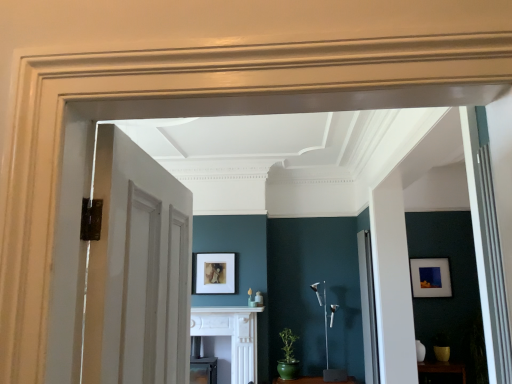
Measure the distance between green matte pot at lower center and camera.

The depth of green matte pot at lower center is 6.25 meters.

In the scene shown: What is the approximate width of white wood door at left, acting as the 2th door starting from the right?

white wood door at left, acting as the 2th door starting from the right, is 8.27 centimeters in width.

Locate an element on the screen. The image size is (512, 384). brown wooden shelf at lower right is located at coordinates (442, 368).

The width and height of the screenshot is (512, 384). I want to click on white marble fireplace at center, so click(x=227, y=309).

Identify the location of matte gold picture frame at center, the 2th picture frame viewed from the right. This screenshot has height=384, width=512. (214, 273).

What is the approximate width of white glossy fireplace at center?

white glossy fireplace at center is 33.21 inches wide.

What do you see at coordinates (368, 308) in the screenshot?
I see `white glossy door at right, which is the 2th door from top to bottom` at bounding box center [368, 308].

This screenshot has width=512, height=384. In order to click on green matte pot at lower center in this screenshot , I will do `click(288, 345)`.

Considering the sizes of objects white glossy door at right, the 2th door in the front-to-back sequence, and white wood door at left, arranged as the second door when viewed from the back, in the image provided, who is bigger, white glossy door at right, the 2th door in the front-to-back sequence, or white wood door at left, arranged as the second door when viewed from the back,?

white glossy door at right, the 2th door in the front-to-back sequence.

Does white glossy door at right, which is counted as the 1th door, starting from the back, touch white wood door at left, the 1th door positioned from the left?

No, white glossy door at right, which is counted as the 1th door, starting from the back, is not making contact with white wood door at left, the 1th door positioned from the left.

Which is correct: white glossy door at right, the 1th door in the right-to-left sequence, is inside white wood door at left, the 1th door positioned from the left, or outside of it?

white glossy door at right, the 1th door in the right-to-left sequence, is outside white wood door at left, the 1th door positioned from the left.

From a real-world perspective, between white glossy door at right, the 1th door in the right-to-left sequence, and white wood door at left, acting as the first door starting from the front, who is vertically lower?

white glossy door at right, the 1th door in the right-to-left sequence, from a real-world perspective.

How different are the orientations of white glossy fireplace at center and white glossy door at right, the 2th door in the front-to-back sequence, in degrees?

The facing directions of white glossy fireplace at center and white glossy door at right, the 2th door in the front-to-back sequence, are 89.6 degrees apart.

Do you think white glossy fireplace at center is within white glossy door at right, which is counted as the 1th door, starting from the back, or outside of it?

The correct answer is: outside.

Is white glossy fireplace at center next to white glossy door at right, which is counted as the 1th door, starting from the back, and touching it?

They are not placed beside each other.

From a real-world perspective, is white glossy fireplace at center over white glossy door at right, which is counted as the 1th door, starting from the back?

Incorrect, from a real-world perspective, white glossy fireplace at center is lower than white glossy door at right, which is counted as the 1th door, starting from the back.

Is green matte pot at lower center facing away from brown wooden shelf at lower right?

No, brown wooden shelf at lower right is not at the back of green matte pot at lower center.

Is green matte pot at lower center outside of brown wooden shelf at lower right?

green matte pot at lower center lies outside brown wooden shelf at lower right's area.

Does green matte pot at lower center come in front of brown wooden shelf at lower right?

No, green matte pot at lower center is further to the viewer.

Based on the photo, from a real-world perspective, is matte gold picture frame at center, which is the second picture frame from back to front, located beneath matte black picture frame at right, acting as the 2th picture frame starting from the front?

No, from a real-world perspective, matte gold picture frame at center, which is the second picture frame from back to front, is not under matte black picture frame at right, acting as the 2th picture frame starting from the front.

In the scene shown: Considering the sizes of objects matte gold picture frame at center, which is the second picture frame from back to front, and matte black picture frame at right, the second picture frame when ordered from left to right, in the image provided, who is shorter, matte gold picture frame at center, which is the second picture frame from back to front, or matte black picture frame at right, the second picture frame when ordered from left to right,?

matte gold picture frame at center, which is the second picture frame from back to front.

Is matte gold picture frame at center, the 2th picture frame viewed from the right, closer to the viewer compared to matte black picture frame at right, the second picture frame when ordered from left to right?

Yes.

Is matte gold picture frame at center, the first picture frame when ordered from front to back, oriented towards matte black picture frame at right, the second picture frame when ordered from left to right?

No, matte gold picture frame at center, the first picture frame when ordered from front to back, is not oriented towards matte black picture frame at right, the second picture frame when ordered from left to right.

Is white wood door at left, positioned as the 1th door in top-to-bottom order, surrounding white marble fireplace at center?

No.

From a real-world perspective, does white wood door at left, positioned as the 1th door in top-to-bottom order, stand above white marble fireplace at center?

Correct, in the physical world, white wood door at left, positioned as the 1th door in top-to-bottom order, is higher than white marble fireplace at center.

Does white wood door at left, the second door positioned from the bottom, appear on the right side of white marble fireplace at center?

Yes, white wood door at left, the second door positioned from the bottom, is to the right of white marble fireplace at center.

In terms of height, does white wood door at left, acting as the first door starting from the front, look taller or shorter compared to white marble fireplace at center?

Considering their sizes, white wood door at left, acting as the first door starting from the front, has more height than white marble fireplace at center.

Is green matte pot at lower center oriented away from white glossy door at right, which is counted as the 1th door, starting from the back?

No, green matte pot at lower center is not facing away from white glossy door at right, which is counted as the 1th door, starting from the back.

Is green matte pot at lower center at the right side of white glossy door at right, the second door viewed from the left?

No.

Between point (233, 345) and point (208, 310), which one is positioned behind?

The point (208, 310) is behind.

From the image's perspective, would you say white glossy fireplace at center is shown under white marble fireplace at center?

Yes, from the image's perspective, white glossy fireplace at center is below white marble fireplace at center.

In the scene shown: From a real-world perspective, is white glossy fireplace at center physically located above or below white marble fireplace at center?

white glossy fireplace at center is situated lower than white marble fireplace at center in the real world.

Does white glossy fireplace at center appear on the left side of white marble fireplace at center?

Yes.

You are a GUI agent. You are given a task and a screenshot of the screen. Output one action in this format:
    pyautogui.click(x=<x>, y=<y>)
    Task: Click on the door in front of the white glossy door at right, which is counted as the 1th door, starting from the bottom
    Image resolution: width=512 pixels, height=384 pixels.
    Given the screenshot: What is the action you would take?
    pyautogui.click(x=137, y=269)

Where is `table to the left of white glossy door at right, which is the 2th door from top to bottom`? The height and width of the screenshot is (384, 512). table to the left of white glossy door at right, which is the 2th door from top to bottom is located at coordinates (232, 336).

From the image, which object appears to be nearer to green matte pot at lower center, white marble fireplace at center or matte gold picture frame at center, the 2th picture frame viewed from the right?

white marble fireplace at center is positioned closer to the anchor green matte pot at lower center.

Estimate the real-world distances between objects in this image. Which object is closer to white glossy fireplace at center, white glossy door at right, which is counted as the 1th door, starting from the back, or matte gold picture frame at center, the 2th picture frame viewed from the right?

Among the two, matte gold picture frame at center, the 2th picture frame viewed from the right, is located nearer to white glossy fireplace at center.

Looking at the image, which one is located closer to matte black picture frame at right, placed as the 1th picture frame when sorted from right to left, white marble fireplace at center or white wood door at left, acting as the 2th door starting from the right?

The object closer to matte black picture frame at right, placed as the 1th picture frame when sorted from right to left, is white marble fireplace at center.

When comparing their distances from white glossy door at right, the 1th door in the right-to-left sequence, does white wood door at left, the second door positioned from the bottom, or matte black picture frame at right, the second picture frame when ordered from left to right, seem closer?

matte black picture frame at right, the second picture frame when ordered from left to right, is closer to white glossy door at right, the 1th door in the right-to-left sequence.

Looking at the image, which one is located closer to white glossy fireplace at center, matte gold picture frame at center, the 2th picture frame viewed from the right, or matte black picture frame at right, which is the first picture frame in back-to-front order?

matte gold picture frame at center, the 2th picture frame viewed from the right, lies closer to white glossy fireplace at center than the other object.

Looking at the image, which one is located closer to brown wooden shelf at lower right, white glossy door at right, the second door viewed from the left, or green matte pot at lower center?

Among the two, white glossy door at right, the second door viewed from the left, is located nearer to brown wooden shelf at lower right.

When comparing their distances from white glossy fireplace at center, does white glossy door at right, the 2th door in the front-to-back sequence, or matte black picture frame at right, placed as the 1th picture frame when sorted from right to left, seem further?

matte black picture frame at right, placed as the 1th picture frame when sorted from right to left, lies further to white glossy fireplace at center than the other object.

Which object lies nearer to the anchor point white glossy fireplace at center, brown wooden shelf at lower right or matte black picture frame at right, the second picture frame when ordered from left to right?

Among the two, brown wooden shelf at lower right is located nearer to white glossy fireplace at center.

Identify the location of table located between white wood door at left, positioned as the 1th door in top-to-bottom order, and brown wooden shelf at lower right in the depth direction. (232, 336).

In order to click on plant between white glossy fireplace at center and white glossy door at right, which is counted as the 1th door, starting from the back, in the horizontal direction in this screenshot , I will do `click(288, 345)`.

At what (x,y) coordinates should I click in order to perform the action: click on furniture positioned between white wood door at left, the second door positioned from the bottom, and matte black picture frame at right, acting as the 2th picture frame starting from the front, from near to far. Please return your answer as a coordinate pair (x, y). The image size is (512, 384). Looking at the image, I should click on (442, 368).

Image resolution: width=512 pixels, height=384 pixels. I want to click on plant between white marble fireplace at center and matte black picture frame at right, the second picture frame when ordered from left to right, in the horizontal direction, so click(288, 345).